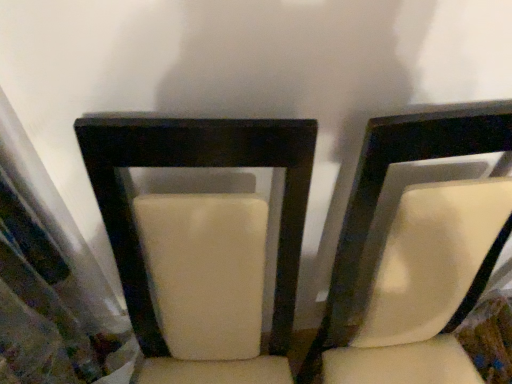
This screenshot has height=384, width=512. Describe the element at coordinates (383, 183) in the screenshot. I see `suede-like white chair at center, which appears as the 1th chair when viewed from the right` at that location.

Locate an element on the screen. suede-like white chair at center, which is counted as the 2th chair, starting from the left is located at coordinates (383, 183).

Where is `suede-like beige chair at center, marked as the second chair in a right-to-left arrangement`? Image resolution: width=512 pixels, height=384 pixels. suede-like beige chair at center, marked as the second chair in a right-to-left arrangement is located at coordinates (202, 243).

What do you see at coordinates (202, 243) in the screenshot?
I see `suede-like beige chair at center, marked as the second chair in a right-to-left arrangement` at bounding box center [202, 243].

The width and height of the screenshot is (512, 384). Identify the location of suede-like white chair at center, which is counted as the 2th chair, starting from the left. (383, 183).

Considering the positions of objects suede-like white chair at center, which appears as the 1th chair when viewed from the right, and suede-like beige chair at center, acting as the first chair starting from the left, in the image provided, who is more to the right, suede-like white chair at center, which appears as the 1th chair when viewed from the right, or suede-like beige chair at center, acting as the first chair starting from the left,?

suede-like white chair at center, which appears as the 1th chair when viewed from the right, is more to the right.

Who is more distant, suede-like white chair at center, which is counted as the 2th chair, starting from the left, or suede-like beige chair at center, marked as the second chair in a right-to-left arrangement?

suede-like white chair at center, which is counted as the 2th chair, starting from the left, is further away from the camera.

Which is in front, point (373, 143) or point (113, 210)?

Point (373, 143)

From the image's perspective, is suede-like white chair at center, which is counted as the 2th chair, starting from the left, under suede-like beige chair at center, acting as the first chair starting from the left?

Actually, suede-like white chair at center, which is counted as the 2th chair, starting from the left, appears above suede-like beige chair at center, acting as the first chair starting from the left, in the image.

From a real-world perspective, does suede-like white chair at center, which is counted as the 2th chair, starting from the left, sit lower than suede-like beige chair at center, marked as the second chair in a right-to-left arrangement?

No, from a real-world perspective, suede-like white chair at center, which is counted as the 2th chair, starting from the left, is not below suede-like beige chair at center, marked as the second chair in a right-to-left arrangement.

Which of these two, suede-like white chair at center, which is counted as the 2th chair, starting from the left, or suede-like beige chair at center, acting as the first chair starting from the left, is wider?

suede-like beige chair at center, acting as the first chair starting from the left.

Which of these two, suede-like white chair at center, which appears as the 1th chair when viewed from the right, or suede-like beige chair at center, acting as the first chair starting from the left, stands shorter?

suede-like beige chair at center, acting as the first chair starting from the left.

In terms of size, does suede-like white chair at center, which appears as the 1th chair when viewed from the right, appear bigger or smaller than suede-like beige chair at center, acting as the first chair starting from the left?

In the image, suede-like white chair at center, which appears as the 1th chair when viewed from the right, appears to be larger than suede-like beige chair at center, acting as the first chair starting from the left.

Would you say suede-like white chair at center, which is counted as the 2th chair, starting from the left, is outside suede-like beige chair at center, acting as the first chair starting from the left?

Indeed, suede-like white chair at center, which is counted as the 2th chair, starting from the left, is completely outside suede-like beige chair at center, acting as the first chair starting from the left.

Is suede-like white chair at center, which appears as the 1th chair when viewed from the right, touching suede-like beige chair at center, marked as the second chair in a right-to-left arrangement?

No, suede-like white chair at center, which appears as the 1th chair when viewed from the right, is not making contact with suede-like beige chair at center, marked as the second chair in a right-to-left arrangement.

Is suede-like white chair at center, which is counted as the 2th chair, starting from the left, turned away from suede-like beige chair at center, acting as the first chair starting from the left?

suede-like white chair at center, which is counted as the 2th chair, starting from the left, is not turned away from suede-like beige chair at center, acting as the first chair starting from the left.

How many degrees apart are the facing directions of suede-like white chair at center, which appears as the 1th chair when viewed from the right, and suede-like beige chair at center, marked as the second chair in a right-to-left arrangement?

3.35 degrees separate the facing orientations of suede-like white chair at center, which appears as the 1th chair when viewed from the right, and suede-like beige chair at center, marked as the second chair in a right-to-left arrangement.

Image resolution: width=512 pixels, height=384 pixels. Identify the location of chair above the suede-like beige chair at center, acting as the first chair starting from the left (from the image's perspective). click(x=383, y=183).

Considering the relative positions of suede-like beige chair at center, marked as the second chair in a right-to-left arrangement, and suede-like white chair at center, which appears as the 1th chair when viewed from the right, in the image provided, is suede-like beige chair at center, marked as the second chair in a right-to-left arrangement, to the left or to the right of suede-like white chair at center, which appears as the 1th chair when viewed from the right,?

Based on their positions, suede-like beige chair at center, marked as the second chair in a right-to-left arrangement, is located to the left of suede-like white chair at center, which appears as the 1th chair when viewed from the right.

Relative to suede-like white chair at center, which appears as the 1th chair when viewed from the right, is suede-like beige chair at center, acting as the first chair starting from the left, in front or behind?

suede-like beige chair at center, acting as the first chair starting from the left, is in front of suede-like white chair at center, which appears as the 1th chair when viewed from the right.

Which point is more distant from viewer, (x=205, y=337) or (x=320, y=331)?

The point (x=320, y=331) is behind.

From the image's perspective, is suede-like beige chair at center, marked as the second chair in a right-to-left arrangement, on suede-like white chair at center, which appears as the 1th chair when viewed from the right?

Incorrect, from the image's perspective, suede-like beige chair at center, marked as the second chair in a right-to-left arrangement, is lower than suede-like white chair at center, which appears as the 1th chair when viewed from the right.

From a real-world perspective, does suede-like beige chair at center, acting as the first chair starting from the left, sit lower than suede-like white chair at center, which appears as the 1th chair when viewed from the right?

Yes.

Which of these two, suede-like beige chair at center, acting as the first chair starting from the left, or suede-like white chair at center, which is counted as the 2th chair, starting from the left, is thinner?

Thinner between the two is suede-like white chair at center, which is counted as the 2th chair, starting from the left.

Does suede-like beige chair at center, marked as the second chair in a right-to-left arrangement, have a lesser height compared to suede-like white chair at center, which appears as the 1th chair when viewed from the right?

Yes.

Considering the sizes of objects suede-like beige chair at center, acting as the first chair starting from the left, and suede-like white chair at center, which is counted as the 2th chair, starting from the left, in the image provided, who is smaller, suede-like beige chair at center, acting as the first chair starting from the left, or suede-like white chair at center, which is counted as the 2th chair, starting from the left,?

suede-like beige chair at center, acting as the first chair starting from the left, is smaller.

Is suede-like beige chair at center, acting as the first chair starting from the left, positioned beyond the bounds of suede-like white chair at center, which appears as the 1th chair when viewed from the right?

That's correct, suede-like beige chair at center, acting as the first chair starting from the left, is outside of suede-like white chair at center, which appears as the 1th chair when viewed from the right.

Is suede-like beige chair at center, acting as the first chair starting from the left, touching suede-like white chair at center, which is counted as the 2th chair, starting from the left?

No, suede-like beige chair at center, acting as the first chair starting from the left, is not in contact with suede-like white chair at center, which is counted as the 2th chair, starting from the left.

Is suede-like beige chair at center, acting as the first chair starting from the left, facing away from suede-like white chair at center, which is counted as the 2th chair, starting from the left?

No, suede-like white chair at center, which is counted as the 2th chair, starting from the left, is not at the back of suede-like beige chair at center, acting as the first chair starting from the left.

How much distance is there between suede-like beige chair at center, acting as the first chair starting from the left, and suede-like white chair at center, which is counted as the 2th chair, starting from the left?

suede-like beige chair at center, acting as the first chair starting from the left, is 22.97 centimeters away from suede-like white chair at center, which is counted as the 2th chair, starting from the left.

The image size is (512, 384). I want to click on chair in front of the suede-like white chair at center, which is counted as the 2th chair, starting from the left, so click(x=202, y=243).

You are a GUI agent. You are given a task and a screenshot of the screen. Output one action in this format:
    pyautogui.click(x=<x>, y=<y>)
    Task: Click on the chair on the left of the suede-like white chair at center, which appears as the 1th chair when viewed from the right
    
    Given the screenshot: What is the action you would take?
    pyautogui.click(x=202, y=243)

This screenshot has width=512, height=384. I want to click on chair positioned vertically above the suede-like beige chair at center, acting as the first chair starting from the left (from a real-world perspective), so click(x=383, y=183).